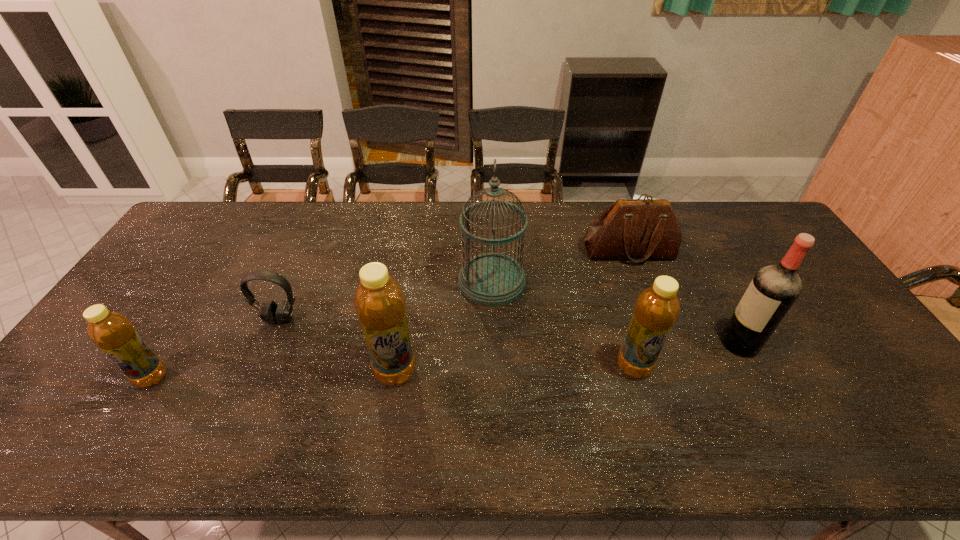
Locate an element on the screen. This screenshot has height=540, width=960. the closest bottle to the second bottle from left to right is located at coordinates (656, 310).

The width and height of the screenshot is (960, 540). Find the location of `bottle that can be found as the second closest to the leftmost object`. bottle that can be found as the second closest to the leftmost object is located at coordinates (656, 310).

What are the coordinates of `vacant space that satisfies the following two spatial constraints: 1. on the front-facing side of the liquor; 2. on the front side of the second tallest bottle` in the screenshot? It's located at (752, 366).

Find the location of a particular element. The image size is (960, 540). free spot that satisfies the following two spatial constraints: 1. on the back side of the fourth shortest object; 2. on the left side of the second bottle from right to left is located at coordinates (396, 366).

Where is `blank space that satisfies the following two spatial constraints: 1. on the front-facing side of the liquor; 2. on the front side of the leftmost bottle`? blank space that satisfies the following two spatial constraints: 1. on the front-facing side of the liquor; 2. on the front side of the leftmost bottle is located at coordinates (757, 377).

Identify the location of vacant area in the image that satisfies the following two spatial constraints: 1. on the front-facing side of the shortest object; 2. on the left side of the rightmost bottle. This screenshot has height=540, width=960. (260, 366).